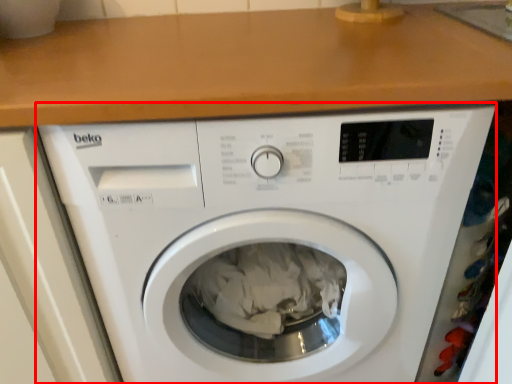
Question: Where is washing machine (annotated by the red box) located in relation to counter top in the image?

Choices:
 (A) right
 (B) left

Answer: (A)